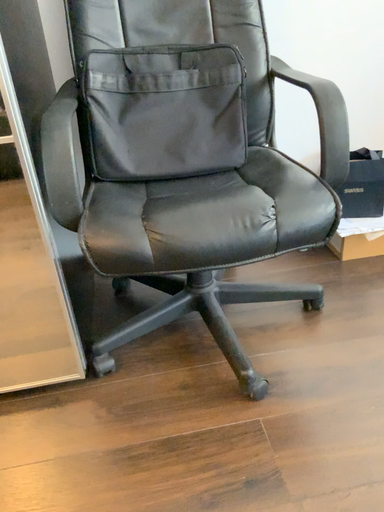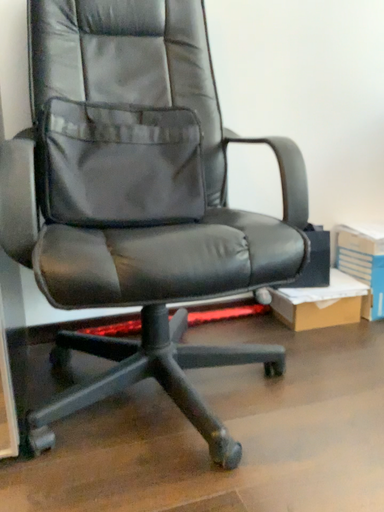
Question: How did the camera likely rotate when shooting the video?

Choices:
 (A) rotated left
 (B) rotated right

Answer: (B)